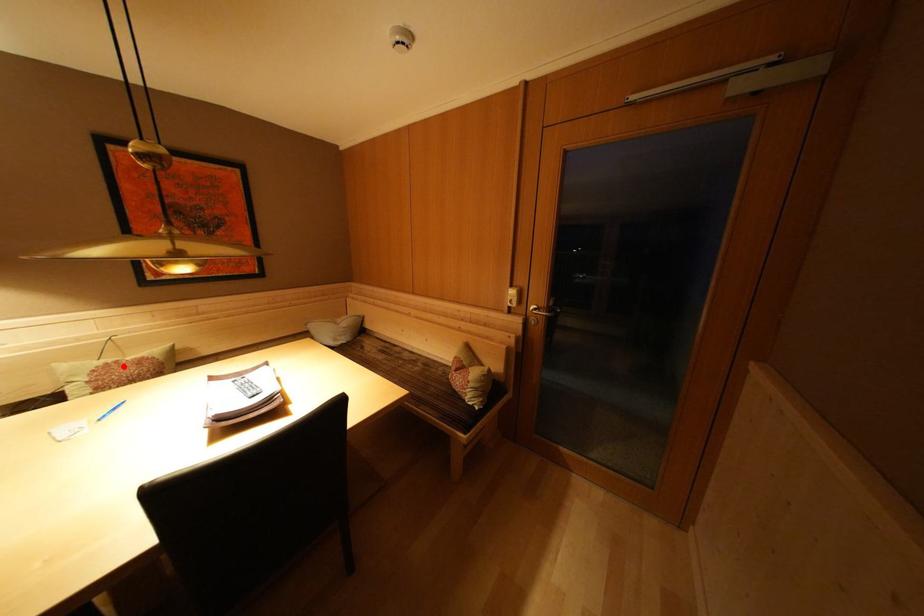
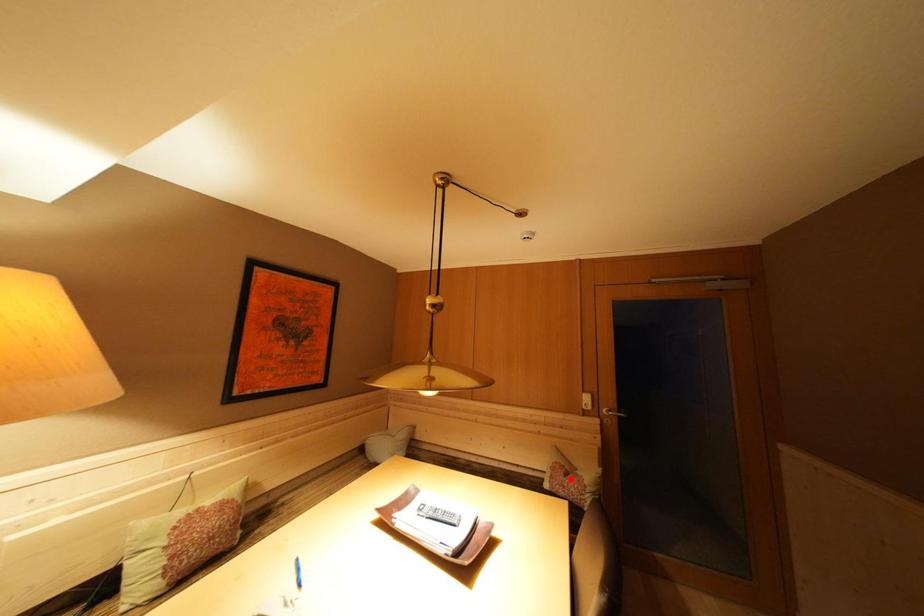
I am providing you with two images of the same scene from different viewpoints. A red point is marked on the first image and another point is marked on the second image. Does the point marked in image1 correspond to the same location as the one in image2?

No